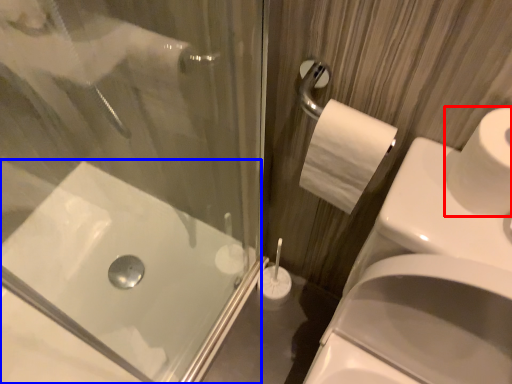
Question: Which of the following is the closest to the observer, toilet paper (highlighted by a red box) or bath (highlighted by a blue box)?

Choices:
 (A) toilet paper
 (B) bath

Answer: (A)